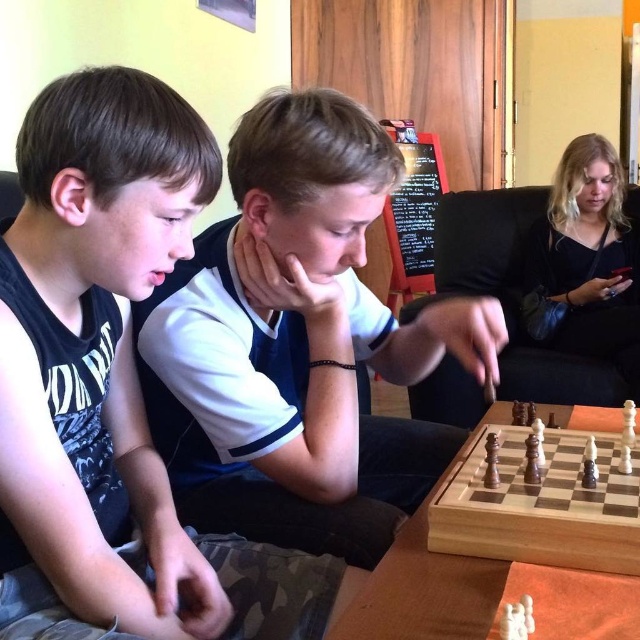
Does black matte shirt at left appear over white matte shirt at center?

Yes, black matte shirt at left is above white matte shirt at center.

Is point (138, 173) closer to viewer compared to point (211, 385)?

Yes, it is in front of point (211, 385).

Find the location of a particular element. Image resolution: width=640 pixels, height=640 pixels. black matte shirt at left is located at coordinates (113, 380).

Is black matte shirt at left thinner than light wood chess set at center?

Indeed, black matte shirt at left has a lesser width compared to light wood chess set at center.

Identify the location of black matte shirt at left. The width and height of the screenshot is (640, 640). (113, 380).

In order to click on black matte shirt at left in this screenshot , I will do `click(113, 380)`.

Does point (278, 344) lie behind point (449, 545)?

Yes, point (278, 344) is behind point (449, 545).

Between white matte shirt at center and light wood chess set at center, which one appears on the right side from the viewer's perspective?

light wood chess set at center is more to the right.

Is point (300, 380) positioned after point (584, 502)?

Yes.

At what (x,y) coordinates should I click in order to perform the action: click on white matte shirt at center. Please return your answer as a coordinate pair (x, y). Looking at the image, I should click on (298, 342).